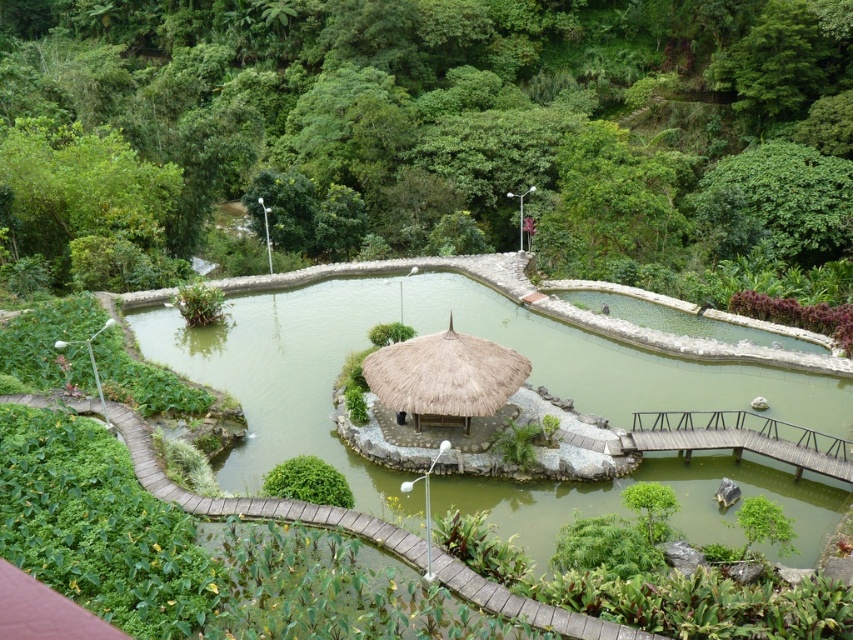
Question: Which object is the closest to the thatched straw hut at center?

Choices:
 (A) green leafy tree at center
 (B) green water at center

Answer: (B)

Question: Among these objects, which one is farthest from the camera?

Choices:
 (A) green leafy tree at center
 (B) thatched straw hut at center
 (C) wooden bridge at lower right
 (D) green water at center

Answer: (A)

Question: Is green leafy tree at center to the left of thatched straw hut at center from the viewer's perspective?

Choices:
 (A) no
 (B) yes

Answer: (B)

Question: Among these objects, which one is farthest from the camera?

Choices:
 (A) green water at center
 (B) green leafy tree at center

Answer: (B)

Question: Does green water at center appear on the right side of thatched straw hut at center?

Choices:
 (A) yes
 (B) no

Answer: (B)

Question: In this image, where is green leafy tree at center located relative to wooden bridge at lower right?

Choices:
 (A) above
 (B) below

Answer: (A)